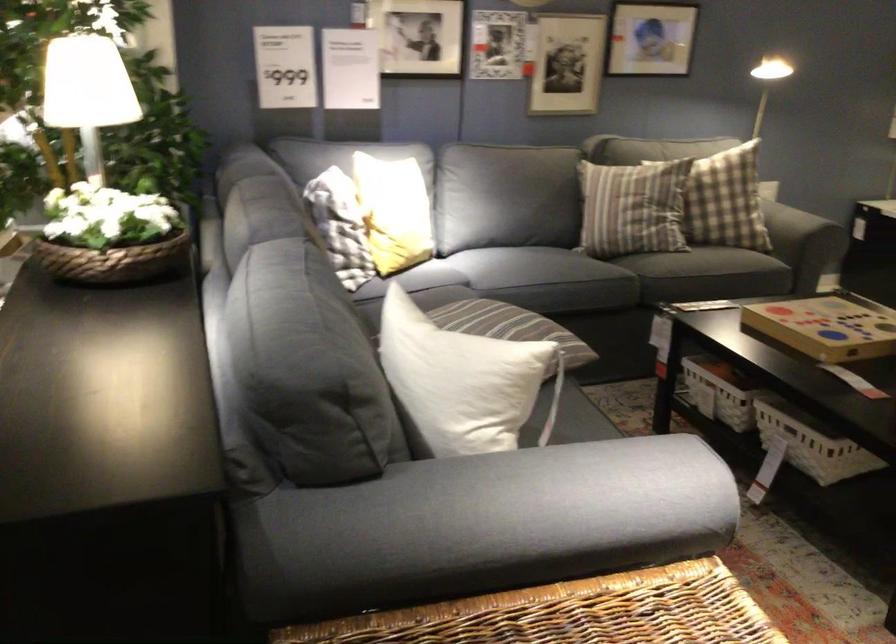
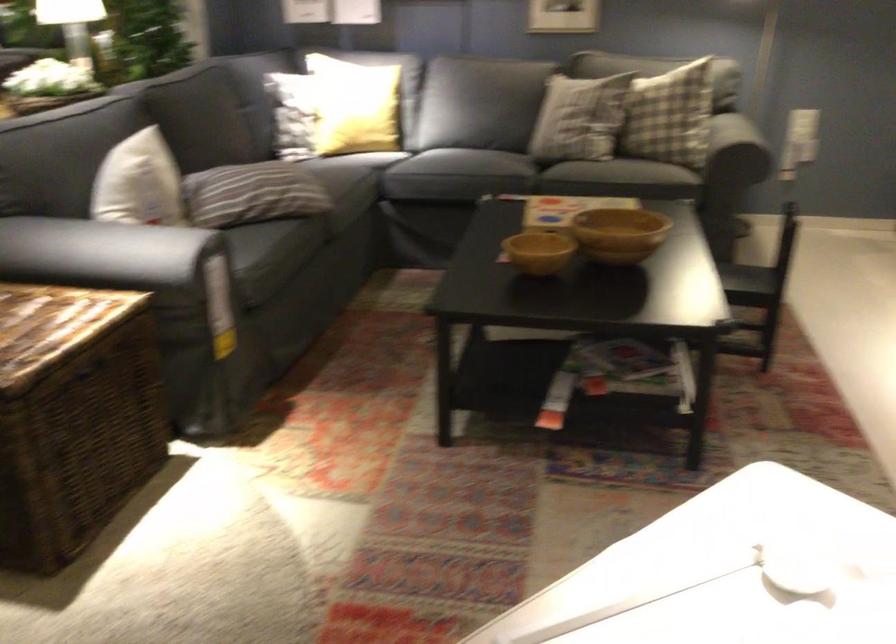
Question: I am providing you with two images of the same scene from different viewpoints. After the viewpoint changes to image2, which objects are now occluded?

Choices:
 (A) black slip-on shoe
 (B) dark sofa armrest
 (C) wicker trunk lid
 (D) sofa sitting surface

Answer: (D)